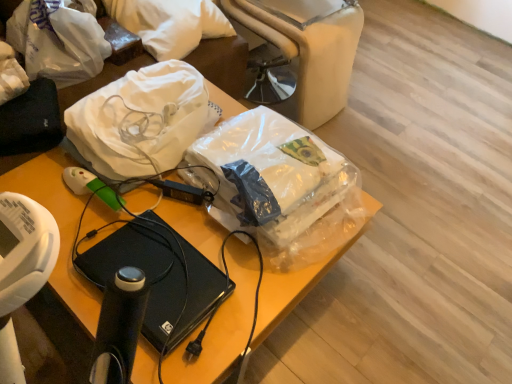
Question: Is translucent plastic bag at center, positioned as the 3th plastic bag in left-to-right order, taller or shorter than white matte plastic bag at upper left, which is the 1th plastic bag in left-to-right order?

Choices:
 (A) tall
 (B) short

Answer: (B)

Question: Visually, is translucent plastic bag at center, which appears as the 1th plastic bag when viewed from the right, positioned to the left or to the right of white matte plastic bag at upper left, which ranks as the 3th plastic bag in right-to-left order?

Choices:
 (A) right
 (B) left

Answer: (A)

Question: Based on their relative distances, which object is nearer to the white soft pillow at upper left?

Choices:
 (A) beige fabric bean bag chair at upper center
 (B) black matte laptop at center
 (C) white matte plastic bag at upper left, which is the 1th plastic bag in left-to-right order
 (D) translucent plastic bag at center, positioned as the 3th plastic bag in left-to-right order
 (E) black plastic laptop at center

Answer: (C)

Question: Estimate the real-world distances between objects in this image. Which object is closer to the white soft pillow at upper left?

Choices:
 (A) translucent plastic bag at center, positioned as the 3th plastic bag in left-to-right order
 (B) beige fabric bean bag chair at upper center
 (C) black matte laptop at center
 (D) transparent plastic bag at upper center, the 2th plastic bag in the left-to-right sequence
 (E) white matte plastic bag at upper left, which is the 1th plastic bag in left-to-right order

Answer: (E)